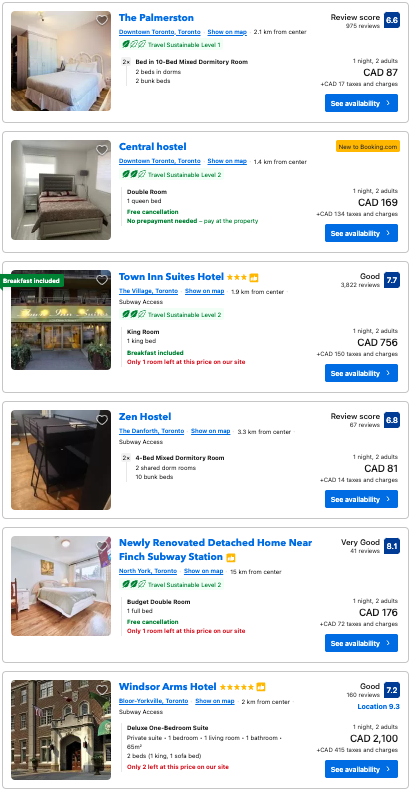
Locate an element on the screen. Image resolution: width=413 pixels, height=792 pixels. bed is located at coordinates (67, 596), (55, 423), (56, 478), (67, 211), (66, 86).